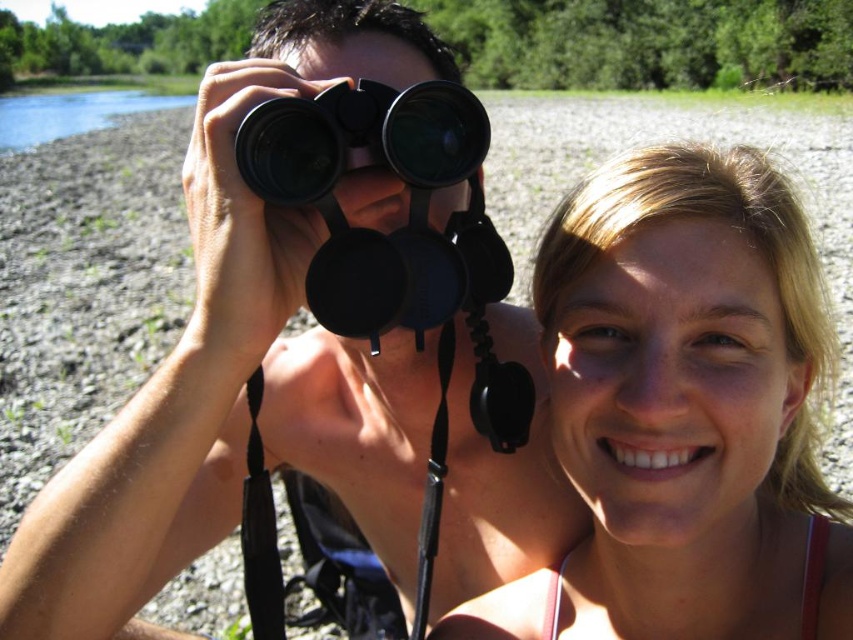
Based on the scene description, where is the black matte binoculars at center located in terms of coordinates?

The black matte binoculars at center are located at coordinates point (x=241, y=369).